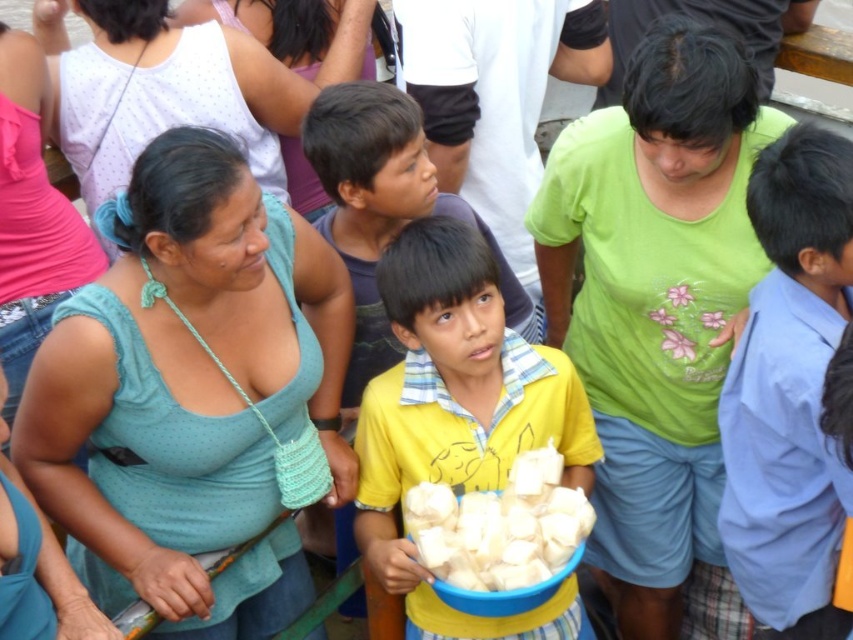
You are a photographer at the event and want to take a photo of both the teal fabric shirt at center and the yellow cotton shirt at center. Which one should you adjust the camera focus on first to ensure both are in the frame?

The teal fabric shirt at center is in front of the yellow cotton shirt at center, so you should focus on the teal fabric shirt at center first to ensure both are in the frame.

You are a photographer trying to capture the white soft bread at center without including the matte green tank top at center in the frame. Is this possible given their positions?

The matte green tank top at center is further to the viewer than white soft bread at center, so the photographer cannot capture the white soft bread at center without including the matte green tank top at center in the frame.